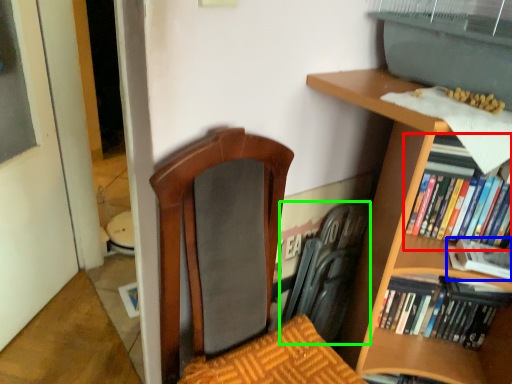
Question: Considering the real-world distances, which object is closest to book (highlighted by a red box)? book (highlighted by a blue box) or swivel chair (highlighted by a green box).

Choices:
 (A) book
 (B) swivel chair

Answer: (A)